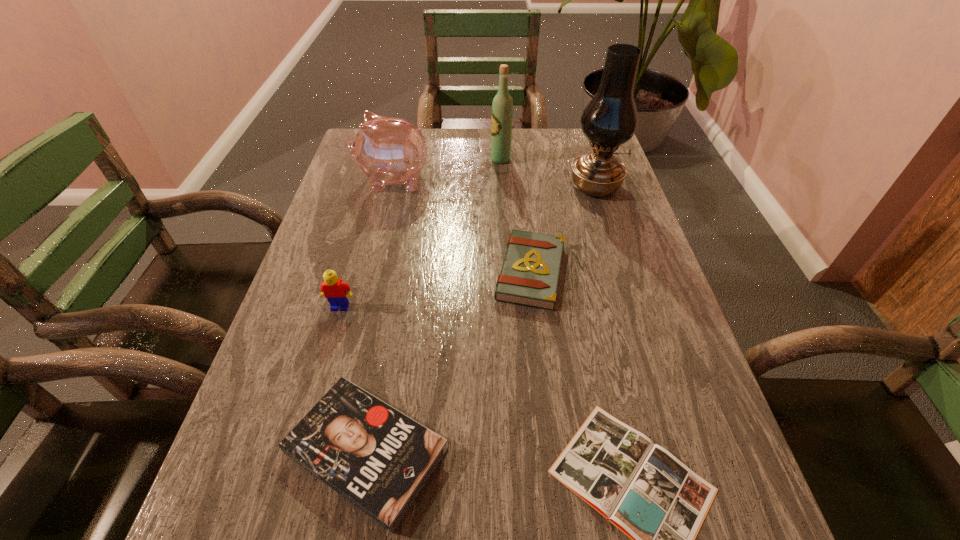
Where is `object located at the far left corner`? The height and width of the screenshot is (540, 960). object located at the far left corner is located at coordinates (388, 150).

At what (x,y) coordinates should I click in order to perform the action: click on object located in the near left corner section of the desktop. Please return your answer as a coordinate pair (x, y). Looking at the image, I should click on (379, 459).

Find the location of a particular element. blank area at the far edge is located at coordinates (513, 163).

I want to click on vacant space at the left edge, so click(268, 521).

This screenshot has height=540, width=960. In order to click on vacant space at the right edge of the desktop in this screenshot , I will do `click(704, 443)`.

Identify the location of free space between the farthest book and the leftmost book. (448, 361).

Find the location of `free space between the fifth shortest object and the farthest book`. free space between the fifth shortest object and the farthest book is located at coordinates (462, 226).

Image resolution: width=960 pixels, height=540 pixels. What are the coordinates of `free spot between the leftmost book and the oil lamp` in the screenshot? It's located at (481, 319).

Find the location of a particular element. The image size is (960, 540). free space between the tallest object and the leftmost book is located at coordinates (481, 319).

At what (x,y) coordinates should I click in order to perform the action: click on unoccupied area between the wine bottle and the piggy bank. Please return your answer as a coordinate pair (x, y). Image resolution: width=960 pixels, height=540 pixels. Looking at the image, I should click on (447, 170).